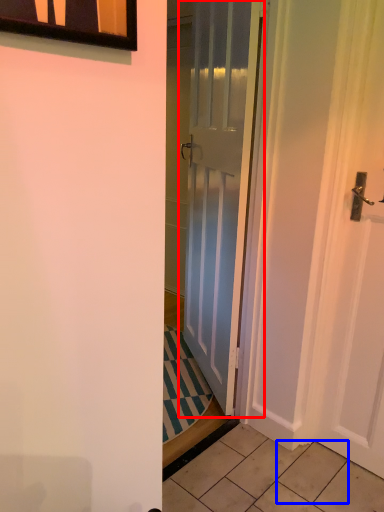
Question: Which point is closer to the camera, door (highlighted by a red box) or tile (highlighted by a blue box)?

Choices:
 (A) door
 (B) tile

Answer: (A)